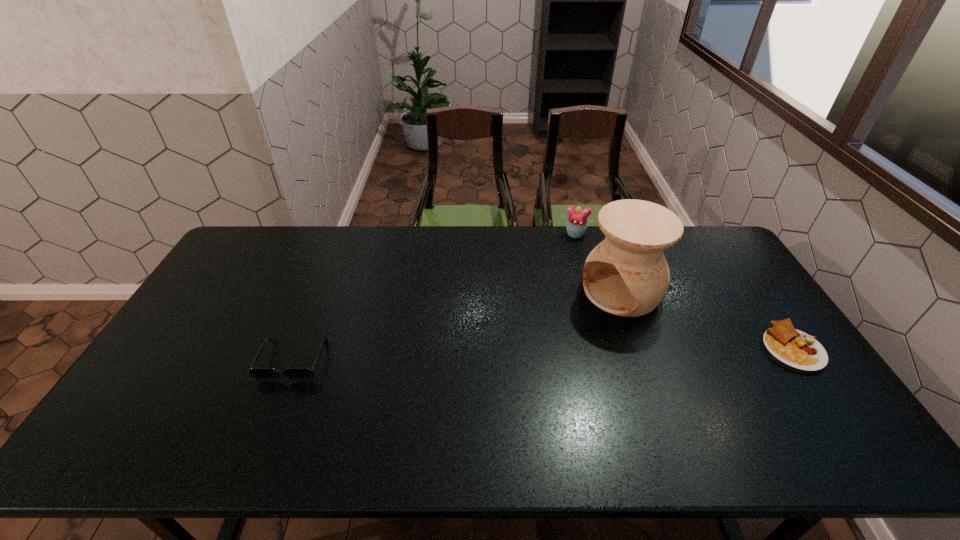
At what (x,y) coordinates should I click in order to perform the action: click on empty space that is in between the second shortest object and the tallest object. Please return your answer as a coordinate pair (x, y). The height and width of the screenshot is (540, 960). Looking at the image, I should click on (458, 326).

This screenshot has width=960, height=540. In order to click on free spot between the farthest object and the rightmost object in this screenshot , I will do `click(683, 291)`.

Select which object appears as the closest to the cupcake. Please provide its 2D coordinates. Your answer should be formatted as a tuple, i.e. [(x, y)], where the tuple contains the x and y coordinates of a point satisfying the conditions above.

[(627, 274)]

You are a GUI agent. You are given a task and a screenshot of the screen. Output one action in this format:
    pyautogui.click(x=<x>, y=<y>)
    Task: Click on the object that is the second closest to the rightmost object
    The image size is (960, 540).
    Given the screenshot: What is the action you would take?
    pyautogui.click(x=576, y=226)

The width and height of the screenshot is (960, 540). I want to click on free space that satisfies the following two spatial constraints: 1. on the front side of the cupcake; 2. on the right side of the rightmost object, so click(606, 348).